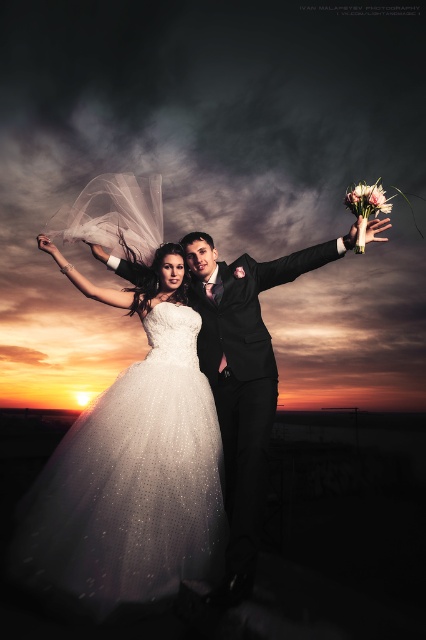
Question: Can you confirm if satin white gown at center is thinner than shiny black suit at center?

Choices:
 (A) yes
 (B) no

Answer: (A)

Question: Which is nearer to the pink silk bouquet at upper right?

Choices:
 (A) satin white gown at center
 (B) shiny black suit at center

Answer: (B)

Question: Does shiny black suit at center appear under pink silk bouquet at upper right?

Choices:
 (A) no
 (B) yes

Answer: (B)

Question: Considering the relative positions of satin white gown at center and pink silk bouquet at upper right in the image provided, where is satin white gown at center located with respect to pink silk bouquet at upper right?

Choices:
 (A) right
 (B) left

Answer: (B)

Question: Which point appears farthest from the camera in this image?

Choices:
 (A) (362, 228)
 (B) (57, 502)

Answer: (A)

Question: Which point appears farthest from the camera in this image?

Choices:
 (A) (232, 419)
 (B) (161, 536)

Answer: (A)